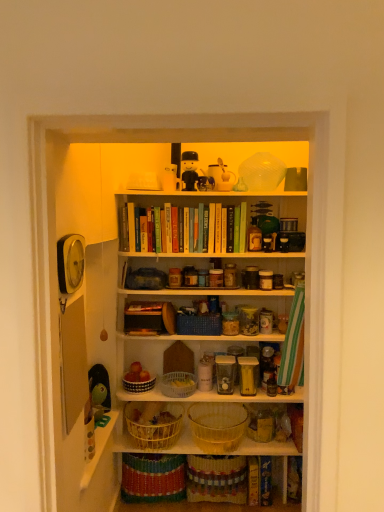
Question: In terms of height, does clear plastic basket at center, the third basket ordered from the bottom, look taller or shorter compared to green rubber duck at left, positioned as the fourth toy in top-to-bottom order?

Choices:
 (A) short
 (B) tall

Answer: (A)

Question: Considering their positions, is clear plastic basket at center, the third basket ordered from the bottom, located in front of or behind green rubber duck at left, positioned as the first toy in left-to-right order?

Choices:
 (A) behind
 (B) front

Answer: (A)

Question: Estimate the real-world distances between objects in this image. Which object is closer to the black plastic toy at upper center, which is counted as the 1th toy, starting from the top?

Choices:
 (A) brightly colored woven baskets at lower center, which ranks as the 1th shelf in bottom-to-top order
 (B) woven yellow basket at center, placed as the fourth basket when sorted from top to bottom
 (C) blue woven basket at center, placed as the first basket when sorted from top to bottom
 (D) wooden shelf at center, marked as the 1th shelf in a top-to-bottom arrangement
 (E) hardcover book at lower right, marked as the second book in a left-to-right arrangement

Answer: (D)

Question: Which object is the farthest from the white plastic spoon at upper center, the 3th toy in the bottom-to-top sequence?

Choices:
 (A) white woven basket at lower center, the 2th basket when ordered from top to bottom
 (B) brightly colored woven baskets at lower center, which ranks as the 1th shelf in back-to-front order
 (C) matte plastic figurine at upper center, which is the second toy in right-to-left order
 (D) blue woven basket at center, which is the fifth basket from bottom to top
 (E) hardcover book at lower right, marked as the second book in a left-to-right arrangement

Answer: (B)